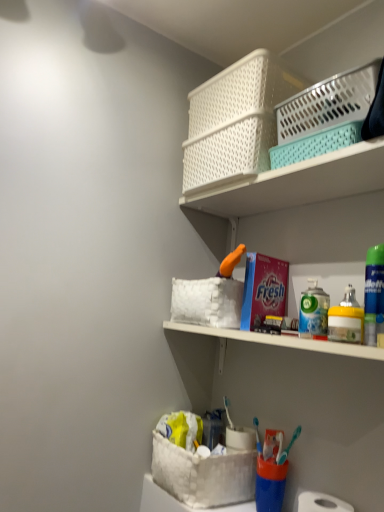
This screenshot has width=384, height=512. In order to click on white fabric basket at lower center, the first basket container in the bottom-to-top sequence in this screenshot , I will do (203, 474).

Identify the location of matte red detergent at center. click(263, 289).

Image resolution: width=384 pixels, height=512 pixels. Find the location of `white fabric basket at lower center, the first basket container in the bottom-to-top sequence`. white fabric basket at lower center, the first basket container in the bottom-to-top sequence is located at coordinates (203, 474).

How far apart are metallic silver mouthwash at shelf right, which appears as the 1th mouthwash when viewed from the left, and matte red detergent at center?

They are 4.17 inches apart.

From a real-world perspective, is metallic silver mouthwash at shelf right, the 1th mouthwash in the back-to-front sequence, above or below matte red detergent at center?

metallic silver mouthwash at shelf right, the 1th mouthwash in the back-to-front sequence, is below matte red detergent at center.

What's the angular difference between metallic silver mouthwash at shelf right, which ranks as the 2th mouthwash in right-to-left order, and matte red detergent at center's facing directions?

The facing directions of metallic silver mouthwash at shelf right, which ranks as the 2th mouthwash in right-to-left order, and matte red detergent at center are 10.4 degrees apart.

Considering the relative sizes of metallic silver mouthwash at shelf right, which ranks as the 2th mouthwash in right-to-left order, and matte red detergent at center in the image provided, is metallic silver mouthwash at shelf right, which ranks as the 2th mouthwash in right-to-left order, taller than matte red detergent at center?

No, metallic silver mouthwash at shelf right, which ranks as the 2th mouthwash in right-to-left order, is not taller than matte red detergent at center.

Is white woven basket at upper center, the third basket container in the bottom-to-top sequence, situated inside white fabric basket at lower center, which is counted as the 3th basket container, starting from the top, or outside?

white woven basket at upper center, the third basket container in the bottom-to-top sequence, is outside white fabric basket at lower center, which is counted as the 3th basket container, starting from the top.

From the image's perspective, does white woven basket at upper center, the third basket container in the bottom-to-top sequence, appear lower than white fabric basket at lower center, the first basket container in the bottom-to-top sequence?

Actually, white woven basket at upper center, the third basket container in the bottom-to-top sequence, appears above white fabric basket at lower center, the first basket container in the bottom-to-top sequence, in the image.

Is white woven basket at upper center, the third basket container in the bottom-to-top sequence, far from white fabric basket at lower center, the first basket container in the bottom-to-top sequence?

They are positioned close to each other.

In terms of width, does white woven basket at upper center, the third basket container in the bottom-to-top sequence, look wider or thinner when compared to white fabric basket at lower center, the first basket container in the bottom-to-top sequence?

Clearly, white woven basket at upper center, the third basket container in the bottom-to-top sequence, has less width compared to white fabric basket at lower center, the first basket container in the bottom-to-top sequence.

From the picture: Considering the relative positions of white woven basket at upper center, placed as the 1th basket container when sorted from top to bottom, and yellow matte spray can at right in the image provided, is white woven basket at upper center, placed as the 1th basket container when sorted from top to bottom, to the right of yellow matte spray can at right from the viewer's perspective?

Incorrect, white woven basket at upper center, placed as the 1th basket container when sorted from top to bottom, is not on the right side of yellow matte spray can at right.

Does white woven basket at upper center, the third basket container in the bottom-to-top sequence, have a lesser height compared to yellow matte spray can at right?

In fact, white woven basket at upper center, the third basket container in the bottom-to-top sequence, may be taller than yellow matte spray can at right.

Does white woven basket at upper center, placed as the 1th basket container when sorted from top to bottom, touch yellow matte spray can at right?

white woven basket at upper center, placed as the 1th basket container when sorted from top to bottom, and yellow matte spray can at right are clearly separated.

Can we say white woven basket at upper center, placed as the 1th basket container when sorted from top to bottom, lies outside yellow matte spray can at right?

white woven basket at upper center, placed as the 1th basket container when sorted from top to bottom, is positioned outside yellow matte spray can at right.

Is white matte toilet paper at lower right at the back of white plastic basket at upper center?

A: No, white plastic basket at upper center is not facing away from white matte toilet paper at lower right.

Who is more distant, white plastic basket at upper center or white matte toilet paper at lower right?

white matte toilet paper at lower right is more distant.

Is white plastic basket at upper center inside the boundaries of white matte toilet paper at lower right, or outside?

The correct answer is: outside.

Who is bigger, white plastic basket at upper center or white matte toilet paper at lower right?

white plastic basket at upper center.

From a real-world perspective, count 2nd basket containers downward from the white woven basket at upper center, the third basket container in the bottom-to-top sequence, and point to it. Please provide its 2D coordinates.

[(203, 474)]

Could you tell me if white fabric basket at lower center, which is counted as the 3th basket container, starting from the top, is facing white woven basket at upper center, the third basket container in the bottom-to-top sequence?

No, white fabric basket at lower center, which is counted as the 3th basket container, starting from the top, is not turned towards white woven basket at upper center, the third basket container in the bottom-to-top sequence.

Which point is more distant from viewer, (194,457) or (236,73)?

The point (236,73) is farther.

Consider the image. From the image's perspective, which one is positioned higher, white fabric basket at lower center, which is counted as the 3th basket container, starting from the top, or white woven basket at upper center, placed as the 1th basket container when sorted from top to bottom?

From the image's view, white woven basket at upper center, placed as the 1th basket container when sorted from top to bottom, is above.

Would you say yellow matte spray can at right is a long distance from green plastic mouthwash at right, which is the first mouthwash in front-to-back order?

Actually, yellow matte spray can at right and green plastic mouthwash at right, which is the first mouthwash in front-to-back order, are a little close together.

Would you say yellow matte spray can at right contains green plastic mouthwash at right, the 2th mouthwash in the back-to-front sequence?

No, green plastic mouthwash at right, the 2th mouthwash in the back-to-front sequence, is located outside of yellow matte spray can at right.

Is yellow matte spray can at right in front of or behind green plastic mouthwash at right, positioned as the first mouthwash in right-to-left order, in the image?

yellow matte spray can at right is positioned farther from the viewer than green plastic mouthwash at right, positioned as the first mouthwash in right-to-left order.

Can you confirm if white matte toilet paper at lower right is positioned to the right of white woven basket at upper center, the third basket container in the bottom-to-top sequence?

Yes.

Identify the location of toilet paper directly beneath the white woven basket at upper center, the third basket container in the bottom-to-top sequence (from a real-world perspective). (321, 503).

Which object is closer to the camera, white matte toilet paper at lower right or white woven basket at upper center, the third basket container in the bottom-to-top sequence?

Positioned in front is white matte toilet paper at lower right.

From a real-world perspective, which object stands above the other?

In real-world perspective, white woven basket at upper center, placed as the 1th basket container when sorted from top to bottom, is above.

From the matte red detergent at center, count 1st mouthwash to the right and point to it. Please provide its 2D coordinates.

[(314, 310)]

The height and width of the screenshot is (512, 384). Identify the location of the 2nd basket container above when counting from the white fabric basket at lower center, which is counted as the 3th basket container, starting from the top (from the image's perspective). click(x=235, y=121).

From the image, which object appears to be nearer to white plastic basket at upper right, the second basket container when ordered from bottom to top, yellow matte spray can at right or white plastic basket at upper center?

The object closer to white plastic basket at upper right, the second basket container when ordered from bottom to top, is white plastic basket at upper center.

From the image, which object appears to be farther from white fabric basket at lower center, the first basket container in the bottom-to-top sequence, white plastic basket at upper right, positioned as the 2th basket container in top-to-bottom order, or white matte toilet paper at lower right?

white plastic basket at upper right, positioned as the 2th basket container in top-to-bottom order, is further to white fabric basket at lower center, the first basket container in the bottom-to-top sequence.

Looking at the image, which one is located further to matte red detergent at center, green plastic mouthwash at right, positioned as the first mouthwash in right-to-left order, or white fabric basket at lower center, the first basket container in the bottom-to-top sequence?

white fabric basket at lower center, the first basket container in the bottom-to-top sequence, is positioned further to the anchor matte red detergent at center.

Estimate the real-world distances between objects in this image. Which object is closer to metallic silver mouthwash at shelf right, which appears as the 1th mouthwash when viewed from the left, matte red detergent at center or yellow matte spray can at right?

Among the two, yellow matte spray can at right is located nearer to metallic silver mouthwash at shelf right, which appears as the 1th mouthwash when viewed from the left.

Which object lies nearer to the anchor point white fabric basket at lower center, the first basket container in the bottom-to-top sequence, white woven basket at upper center, the third basket container in the bottom-to-top sequence, or white plastic basket at upper right, the second basket container when ordered from bottom to top?

Based on the image, white woven basket at upper center, the third basket container in the bottom-to-top sequence, appears to be nearer to white fabric basket at lower center, the first basket container in the bottom-to-top sequence.

Based on their spatial positions, is matte red detergent at center or yellow matte spray can at right further from white woven basket at upper center, the third basket container in the bottom-to-top sequence?

Based on the image, yellow matte spray can at right appears to be further to white woven basket at upper center, the third basket container in the bottom-to-top sequence.

From the picture: Based on their spatial positions, is white plastic basket at upper right, positioned as the 2th basket container in top-to-bottom order, or yellow matte spray can at right further from white fabric basket at lower center, which is counted as the 3th basket container, starting from the top?

Among the two, white plastic basket at upper right, positioned as the 2th basket container in top-to-bottom order, is located further to white fabric basket at lower center, which is counted as the 3th basket container, starting from the top.

Based on their spatial positions, is white plastic basket at upper right, the second basket container when ordered from bottom to top, or white matte toilet paper at lower right closer to white plastic basket at upper center?

white plastic basket at upper right, the second basket container when ordered from bottom to top, is positioned closer to the anchor white plastic basket at upper center.

This screenshot has width=384, height=512. I want to click on basket container between matte red detergent at center and white matte toilet paper at lower right in the up-down direction, so click(203, 474).

Where is `shelf between white woven basket at upper center, the third basket container in the bottom-to-top sequence, and white fabric basket at lower center, the first basket container in the bottom-to-top sequence, in the up-down direction`? shelf between white woven basket at upper center, the third basket container in the bottom-to-top sequence, and white fabric basket at lower center, the first basket container in the bottom-to-top sequence, in the up-down direction is located at coordinates (299, 183).

At what (x,y) coordinates should I click in order to perform the action: click on shelf between white plastic basket at upper right, positioned as the 2th basket container in top-to-bottom order, and yellow matte spray can at right, in the vertical direction. Please return your answer as a coordinate pair (x, y). Looking at the image, I should click on (299, 183).

This screenshot has height=512, width=384. I want to click on shelf that lies between white woven basket at upper center, the third basket container in the bottom-to-top sequence, and metallic silver mouthwash at shelf right, which appears as the 1th mouthwash when viewed from the left, from top to bottom, so click(x=299, y=183).